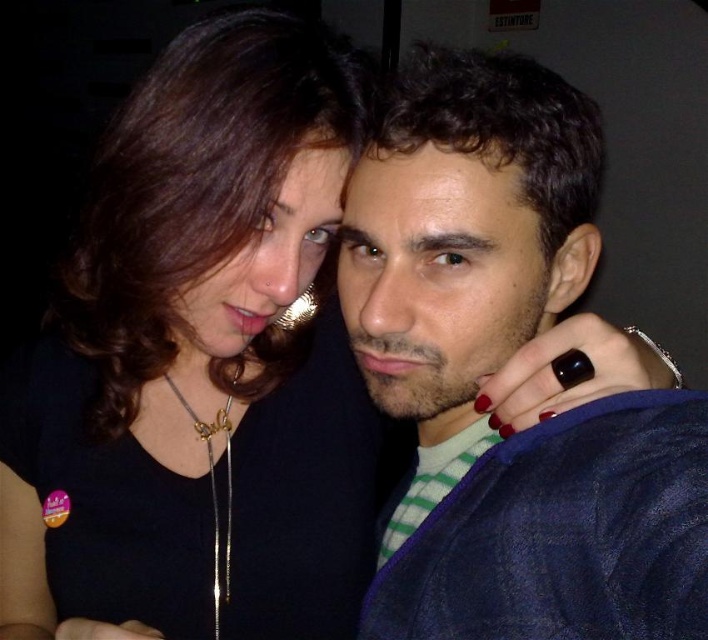
You are a jeweler examining two necklaces in an image. The black matte necklace at upper left and the gold chain necklace at center. Which one is wider?

The black matte necklace at upper left is wider than the gold chain necklace at center.

You are a fashion designer analyzing the image. You need to determine if the black matte necklace at upper left can fit inside the dark blue denim jacket at center. Can it fit?

The black matte necklace at upper left might be wider than dark blue denim jacket at center, so there is a possibility it cannot fit inside the jacket.